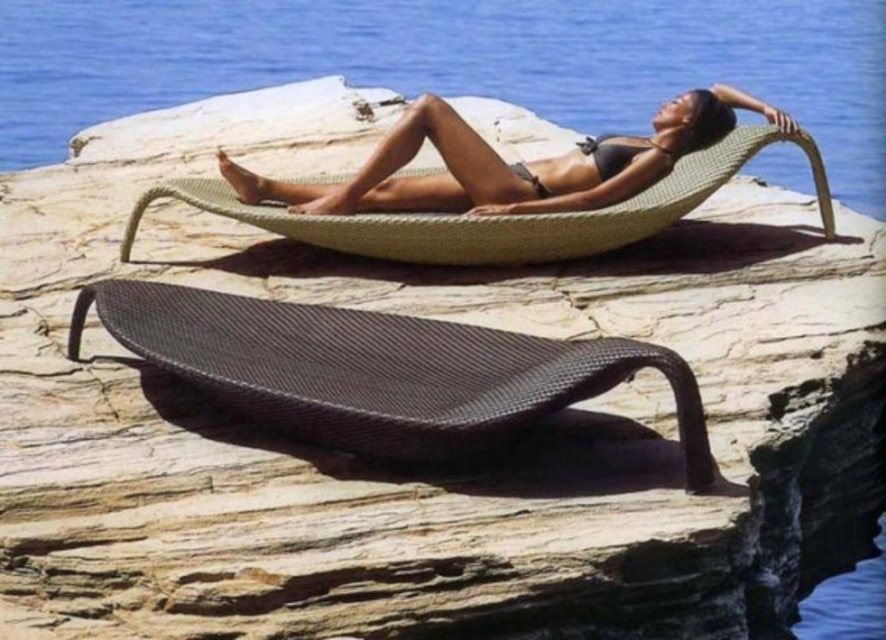
You are a photographer trying to capture the perfect shot of the matte black bikini at center and the beige woven hammock at center. Which object should you focus on first if you want to ensure both are in frame without moving the camera?

You should focus on the matte black bikini at center first because it is taller than the beige woven hammock at center, so it will occupy more space in the frame and help you adjust the camera angle to include both objects.

You are a photographer planning to take a photo of the matte black daybed at center and the clear blue water at upper center. Based on their heights, which object should you focus on first if you want to capture both in a single frame without moving the camera?

The clear blue water at upper center has a greater height compared to the matte black daybed at center, so you should focus on the clear blue water at upper center first to ensure both are in frame.